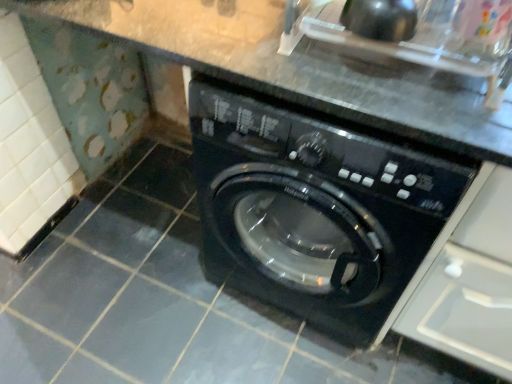
Where is `blank space to the left of black glossy sink at upper right`? The image size is (512, 384). blank space to the left of black glossy sink at upper right is located at coordinates (255, 45).